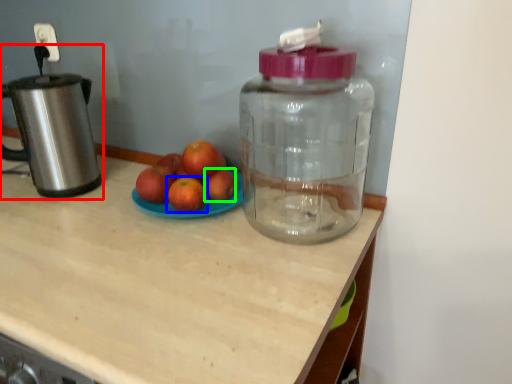
Question: Which object is the farthest from kitchen appliance (highlighted by a red box)? Choose among these: grapefruit (highlighted by a blue box) or apple (highlighted by a green box).

Choices:
 (A) grapefruit
 (B) apple

Answer: (B)